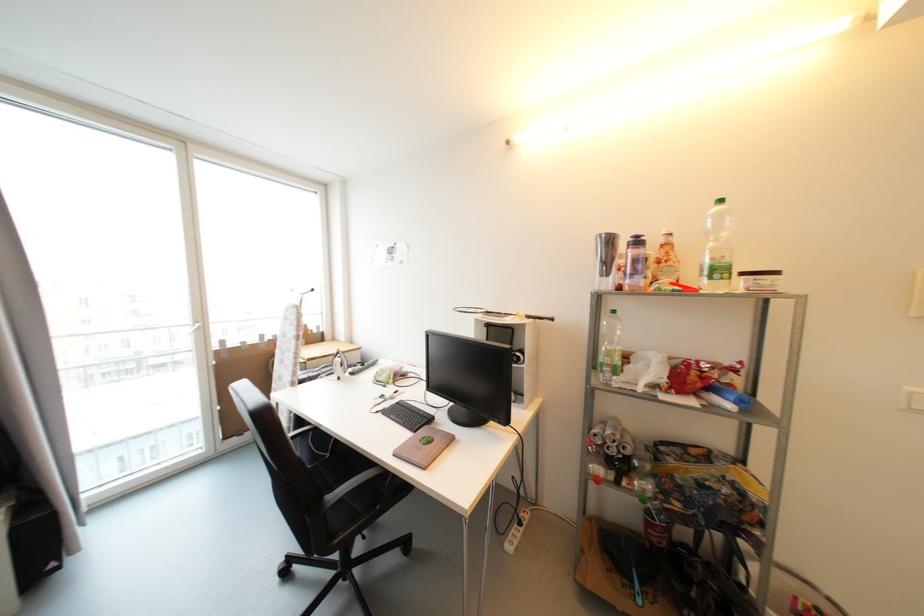
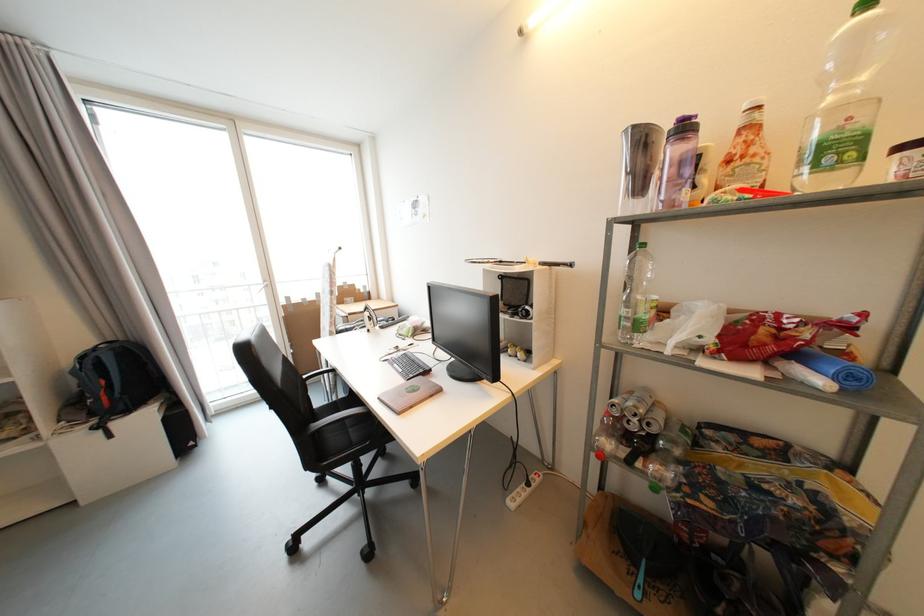
Locate, in the second image, the point that corresponds to [613,435] in the first image.

(635, 406)